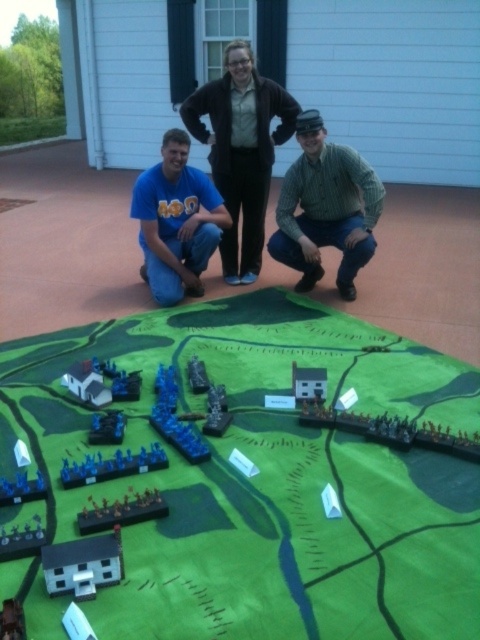
Question: Which point is farther to the camera?

Choices:
 (A) blue plastic toy soldiers at lower left
 (B) matte black jacket at center

Answer: (B)

Question: Does blue matte t-shirt at center come behind blue plastic soldiers at lower center?

Choices:
 (A) no
 (B) yes

Answer: (B)

Question: Does matte black jacket at center have a greater width compared to green striped shirt at center?

Choices:
 (A) no
 (B) yes

Answer: (B)

Question: Estimate the real-world distances between objects in this image. Which object is farther from the green striped shirt at center?

Choices:
 (A) matte black jacket at center
 (B) blue plastic toy soldiers at lower left
 (C) blue plastic soldiers at lower center
 (D) brushed metal toy at lower left

Answer: (B)

Question: Which object is positioned farthest from the matte black jacket at center?

Choices:
 (A) blue matte t-shirt at center
 (B) green striped shirt at center
 (C) blue plastic soldiers at lower center

Answer: (C)

Question: Where is green striped shirt at center located in relation to blue matte t-shirt at center in the image?

Choices:
 (A) left
 (B) right

Answer: (B)